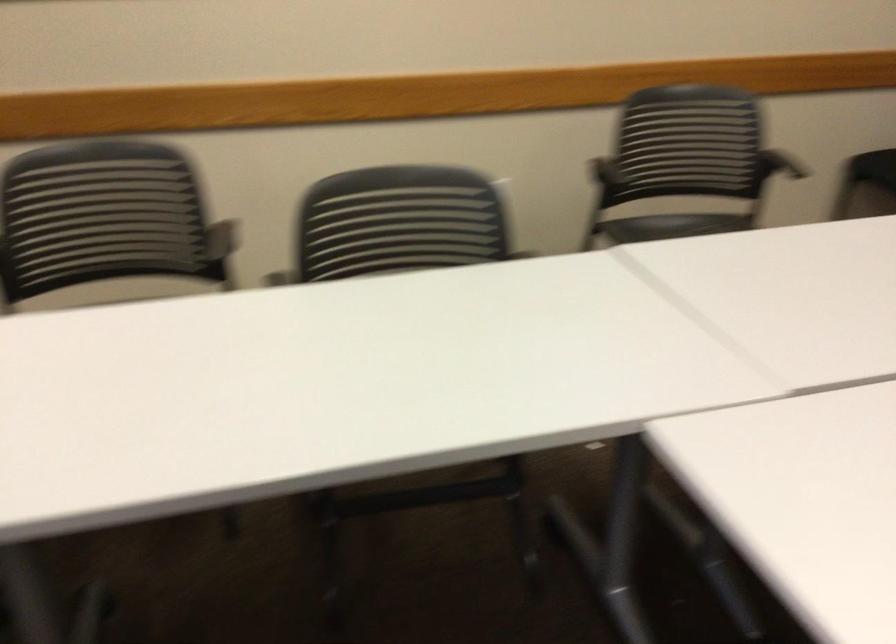
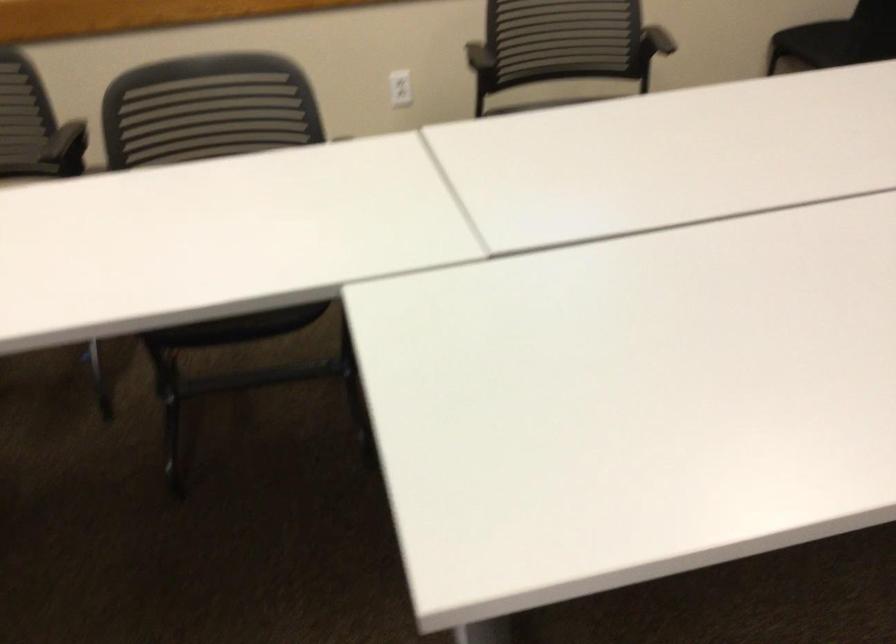
Question: How did the camera likely rotate?

Choices:
 (A) Left
 (B) Right
 (C) Up
 (D) Down

Answer: (D)